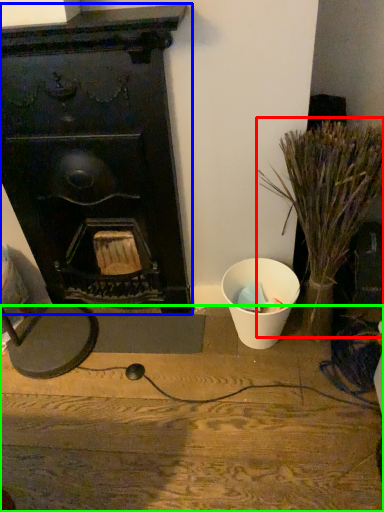
Question: Estimate the real-world distances between objects in this image. Which object is farther from plant (highlighted by a red box), fireplace (highlighted by a blue box) or furniture (highlighted by a green box)?

Choices:
 (A) fireplace
 (B) furniture

Answer: (B)